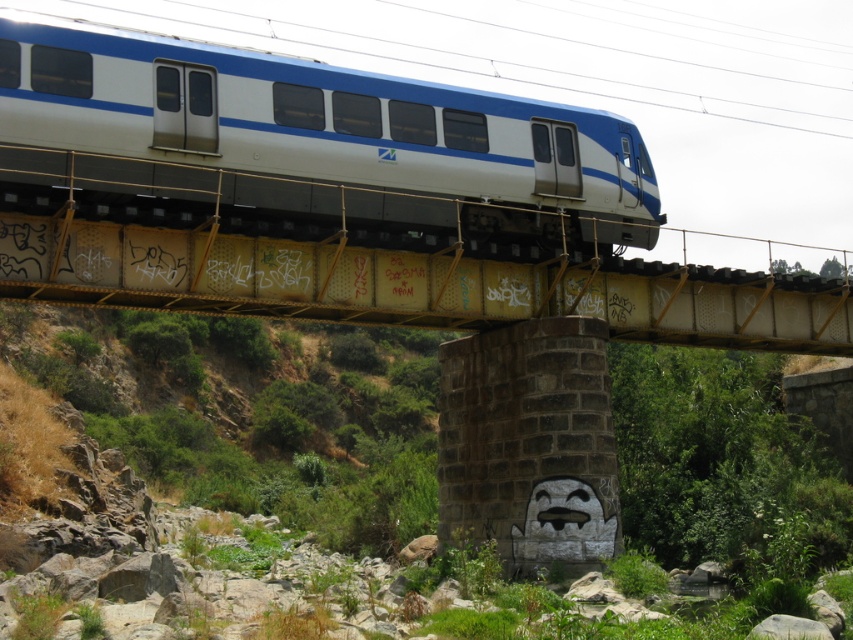
Describe the element at coordinates (252, 412) in the screenshot. I see `green grassy hillside at lower left` at that location.

From the picture: Does green grassy hillside at lower left lie in front of white glossy train at center?

Yes, it is in front of white glossy train at center.

Is point (96, 433) less distant than point (384, 131)?

That is False.

Locate an element on the screen. The height and width of the screenshot is (640, 853). green grassy hillside at lower left is located at coordinates (252, 412).